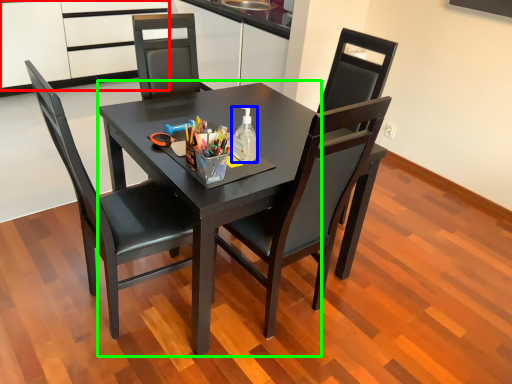
Question: Which object is the closest to the cabinetry (highlighted by a red box)? Choose among these: bottle (highlighted by a blue box) or round table (highlighted by a green box).

Choices:
 (A) bottle
 (B) round table

Answer: (B)